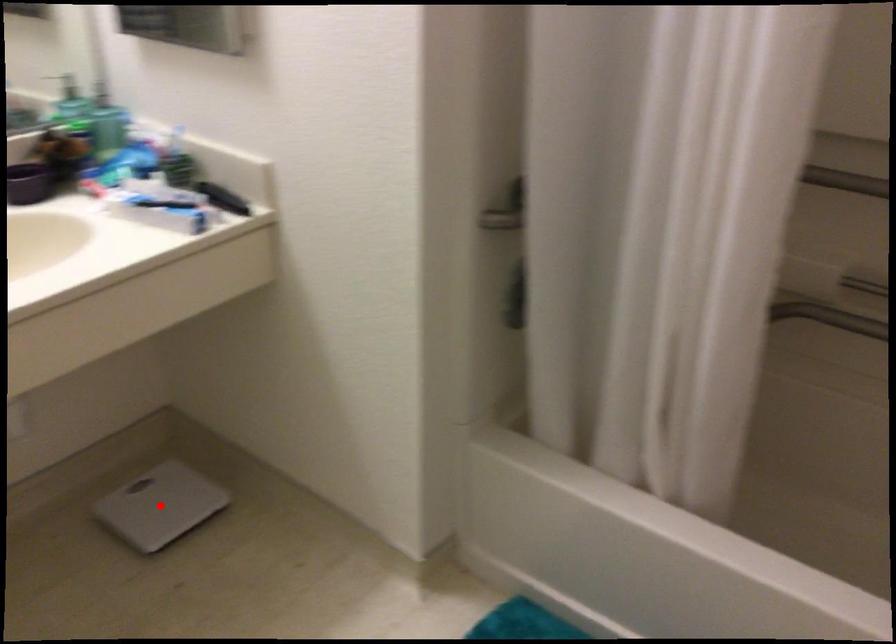
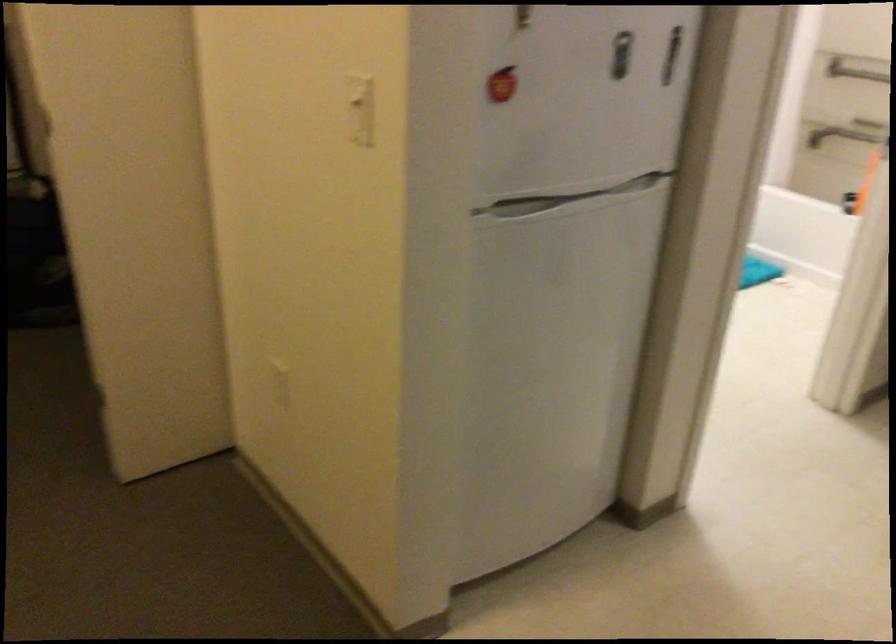
Question: I am providing you with two images of the same scene from different viewpoints. A red point is marked on the first image. Is the red point's position out of view in image 2?

Choices:
 (A) Yes
 (B) No

Answer: (A)